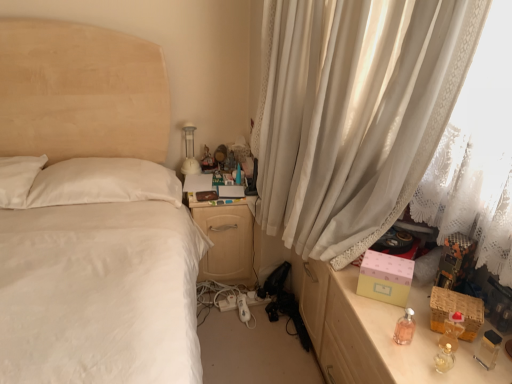
Where is `vacant region to the left of pink glass perfume at lower right, which is the second perfume in right-to-left order`? This screenshot has height=384, width=512. vacant region to the left of pink glass perfume at lower right, which is the second perfume in right-to-left order is located at coordinates (369, 331).